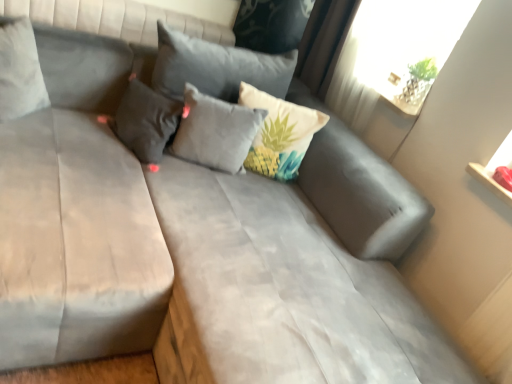
Question: From the image's perspective, is light gray fabric pillow at center, the 2th pillow when ordered from right to left, located beneath transparent glass window screen at upper right?

Choices:
 (A) no
 (B) yes

Answer: (B)

Question: Is light gray fabric pillow at center, which is the third pillow from left to right, next to transparent glass window screen at upper right?

Choices:
 (A) no
 (B) yes

Answer: (A)

Question: Considering the relative sizes of light gray fabric pillow at center, which is the third pillow from left to right, and transparent glass window screen at upper right in the image provided, is light gray fabric pillow at center, which is the third pillow from left to right, thinner than transparent glass window screen at upper right?

Choices:
 (A) no
 (B) yes

Answer: (A)

Question: Is transparent glass window screen at upper right completely or partially inside light gray fabric pillow at center, the 2th pillow when ordered from right to left?

Choices:
 (A) yes
 (B) no

Answer: (B)

Question: Does light gray fabric pillow at center, the 2th pillow when ordered from right to left, appear on the right side of transparent glass window screen at upper right?

Choices:
 (A) no
 (B) yes

Answer: (A)

Question: Is suede gray mattress at center, the 1th mattress when ordered from right to left, wider or thinner than beige fabric pillow with tropical print at center, the 4th pillow when ordered from left to right?

Choices:
 (A) wide
 (B) thin

Answer: (A)

Question: Considering the positions of suede gray mattress at center, the second mattress from the left, and beige fabric pillow with tropical print at center, the 4th pillow when ordered from left to right, in the image, is suede gray mattress at center, the second mattress from the left, taller or shorter than beige fabric pillow with tropical print at center, the 4th pillow when ordered from left to right,?

Choices:
 (A) tall
 (B) short

Answer: (A)

Question: Would you say suede gray mattress at center, the second mattress from the left, is to the left or to the right of beige fabric pillow with tropical print at center, acting as the first pillow starting from the right, in the picture?

Choices:
 (A) left
 (B) right

Answer: (A)

Question: In the image, is suede gray mattress at center, the 1th mattress when ordered from right to left, positioned in front of or behind beige fabric pillow with tropical print at center, the 4th pillow when ordered from left to right?

Choices:
 (A) behind
 (B) front

Answer: (B)

Question: From a real-world perspective, relative to transparent glass window screen at upper right, is suede gray mattress at left, placed as the 2th mattress when sorted from right to left, vertically above or below?

Choices:
 (A) above
 (B) below

Answer: (B)

Question: Based on their sizes in the image, would you say suede gray mattress at left, the 1th mattress when ordered from left to right, is bigger or smaller than transparent glass window screen at upper right?

Choices:
 (A) big
 (B) small

Answer: (A)

Question: Considering the relative positions of suede gray mattress at left, the 1th mattress when ordered from left to right, and transparent glass window screen at upper right in the image provided, is suede gray mattress at left, the 1th mattress when ordered from left to right, to the left or to the right of transparent glass window screen at upper right?

Choices:
 (A) left
 (B) right

Answer: (A)

Question: Is suede gray mattress at left, the 1th mattress when ordered from left to right, in front of or behind transparent glass window screen at upper right in the image?

Choices:
 (A) front
 (B) behind

Answer: (A)

Question: From a real-world perspective, is suede gray mattress at center, the 1th mattress when ordered from right to left, positioned above or below dark gray fabric pillow at upper left, placed as the 3th pillow when sorted from right to left?

Choices:
 (A) below
 (B) above

Answer: (A)

Question: Is suede gray mattress at center, the 1th mattress when ordered from right to left, in front of or behind dark gray fabric pillow at upper left, the second pillow viewed from the left, in the image?

Choices:
 (A) front
 (B) behind

Answer: (A)